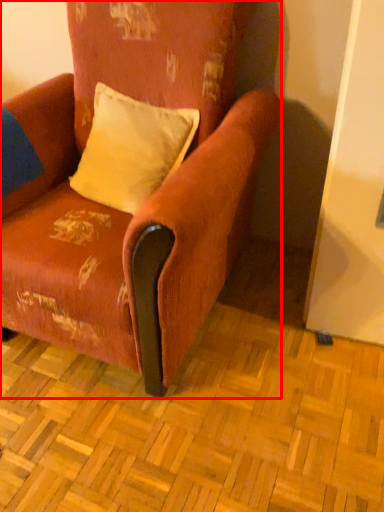
Question: From the image's perspective, what is the correct spatial positioning of chair (annotated by the red box) in reference to pillow?

Choices:
 (A) below
 (B) above

Answer: (A)